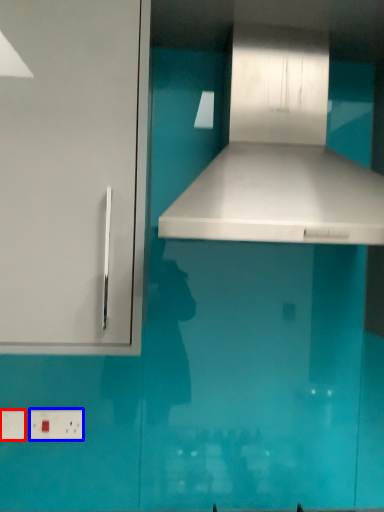
Question: Which object is further to the camera taking this photo, electric outlet (highlighted by a red box) or electric outlet (highlighted by a blue box)?

Choices:
 (A) electric outlet
 (B) electric outlet

Answer: (B)